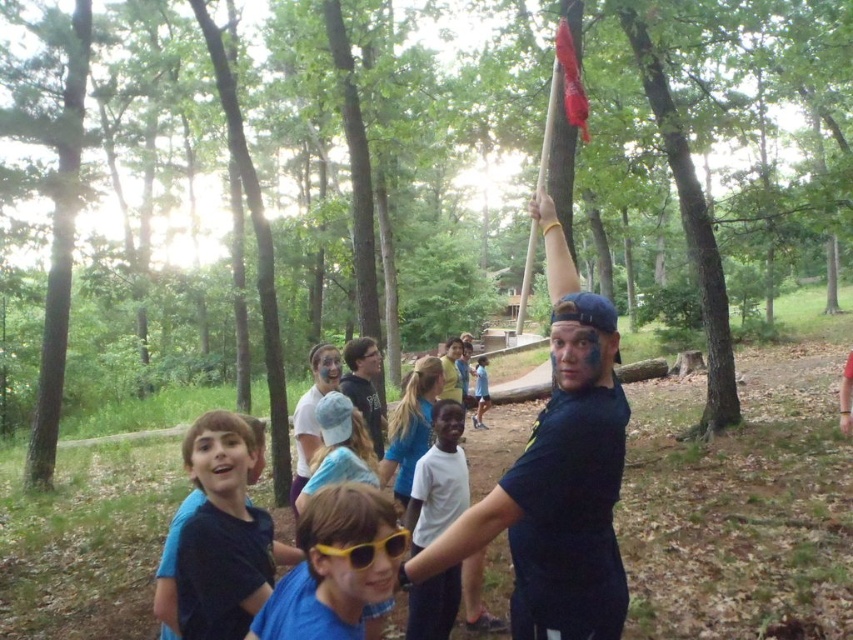
You are a photographer taking a picture of the matte blue face paint at center and the matte blue shirt at center in the wooded area. Which object should you focus on first if you want to capture both in the frame without moving the camera?

The matte blue face paint at center is to the left of the matte blue shirt at center, so you should focus on the matte blue face paint at center first to ensure both are in the frame without moving the camera.